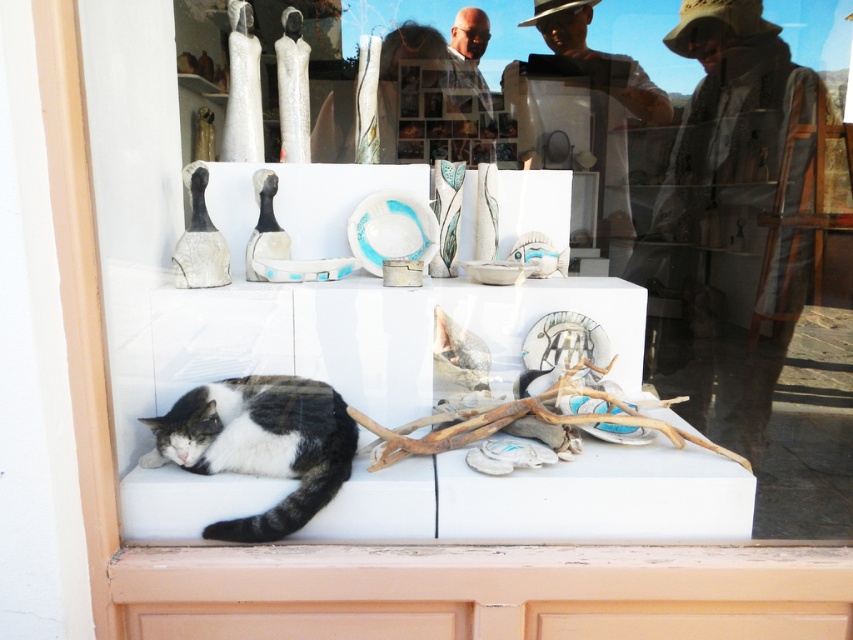
Question: Can you confirm if black-and-white fur cat at lower left is smaller than natural wood driftwood at center?

Choices:
 (A) yes
 (B) no

Answer: (A)

Question: Can you confirm if black-and-white fur cat at lower left is smaller than natural wood driftwood at center?

Choices:
 (A) yes
 (B) no

Answer: (A)

Question: Does black-and-white fur cat at lower left come in front of natural wood driftwood at center?

Choices:
 (A) no
 (B) yes

Answer: (B)

Question: Which object is farther from the camera taking this photo?

Choices:
 (A) black-and-white fur cat at lower left
 (B) natural wood driftwood at center

Answer: (B)